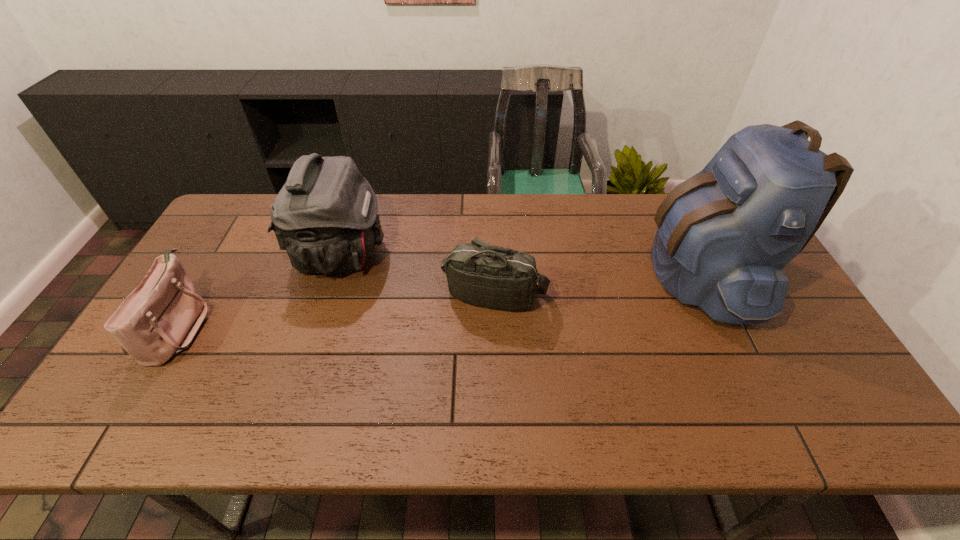
The width and height of the screenshot is (960, 540). I want to click on vacant space situated at the front pocket of the backpack, so point(620,273).

The image size is (960, 540). Identify the location of vacant point located 0.250m on the open flap of the second shoulder bag from left to right. (468, 254).

Where is `free spot located at the front padded panel of the second shortest shoulder bag`? Image resolution: width=960 pixels, height=540 pixels. free spot located at the front padded panel of the second shortest shoulder bag is located at coordinates (498, 413).

Locate an element on the screen. This screenshot has width=960, height=540. vacant area situated 0.070m on the front pocket of the shortest shoulder bag is located at coordinates pyautogui.click(x=231, y=326).

This screenshot has height=540, width=960. Identify the location of backpack located at the far edge. (724, 236).

I want to click on shoulder bag present at the far edge, so click(325, 216).

This screenshot has height=540, width=960. What are the coordinates of `object that is at the left edge` in the screenshot? It's located at (158, 319).

The image size is (960, 540). Identify the location of object that is at the right edge. (724, 236).

Identify the location of object positioned at the far right corner. This screenshot has width=960, height=540. (724, 236).

The height and width of the screenshot is (540, 960). I want to click on free space at the far edge, so click(x=581, y=197).